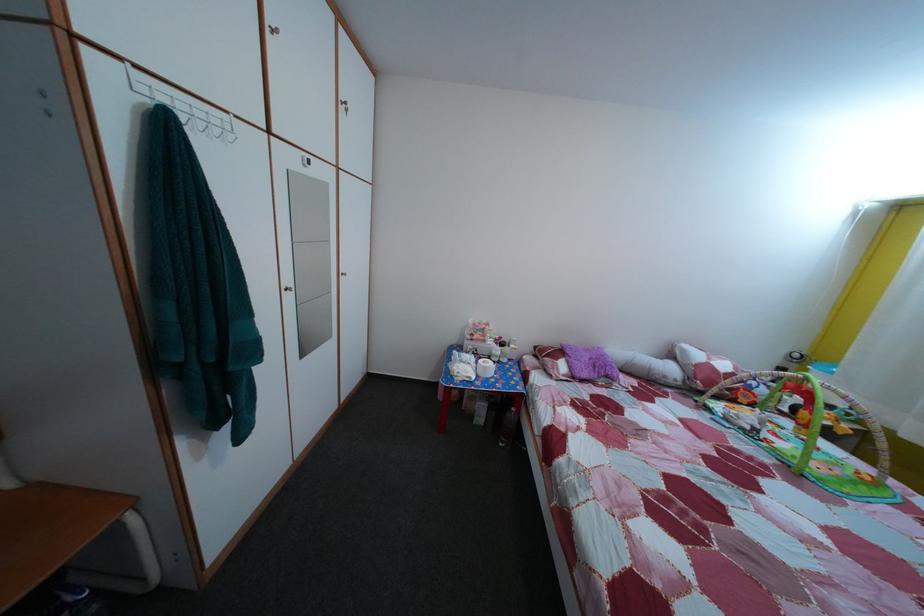
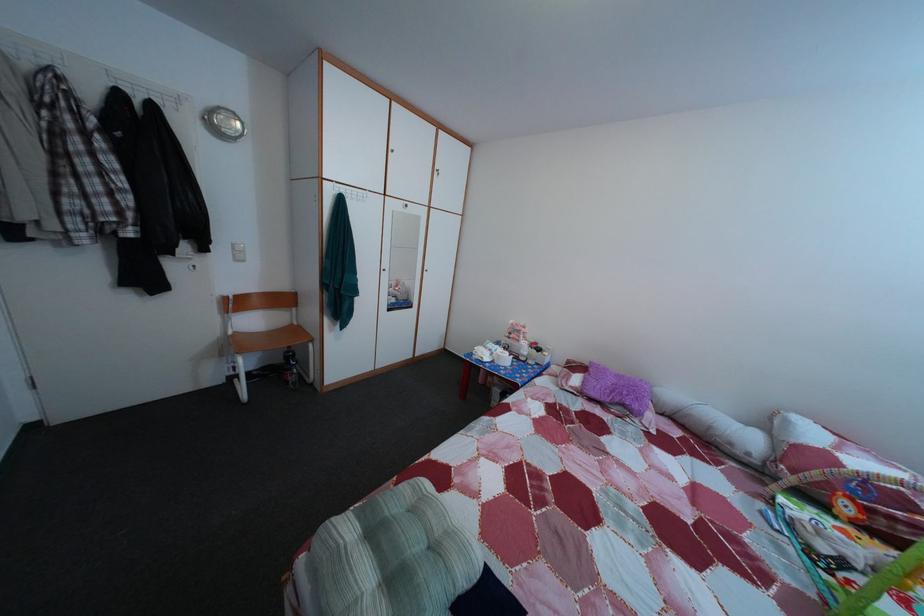
Locate, in the second image, the point that corresponds to pixel 493 349 in the first image.

(528, 349)